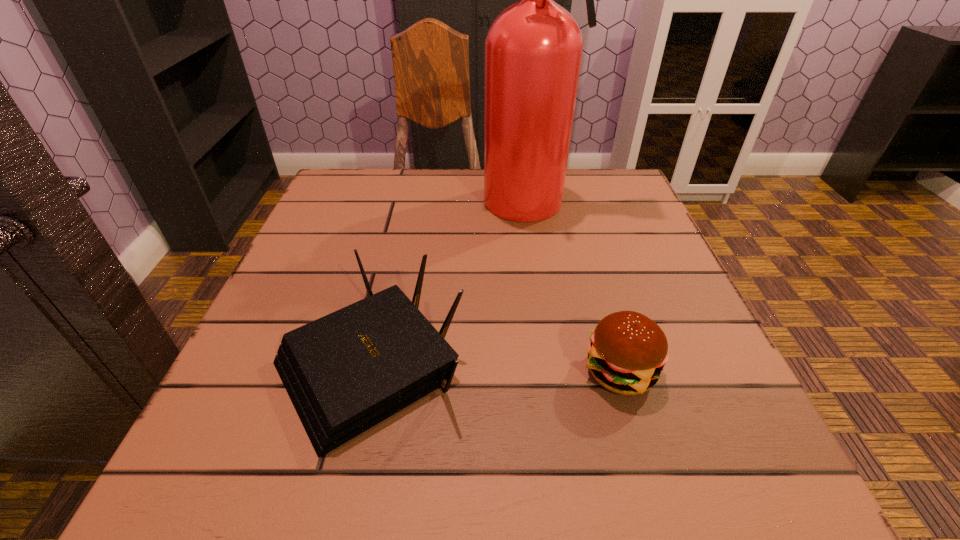
At what (x,y) coordinates should I click in order to perform the action: click on object that is at the left edge. Please return your answer as a coordinate pair (x, y). The width and height of the screenshot is (960, 540). Looking at the image, I should click on (346, 372).

Locate an element on the screen. Image resolution: width=960 pixels, height=540 pixels. fire extinguisher situated at the right edge is located at coordinates (533, 50).

This screenshot has width=960, height=540. Identify the location of hamburger positioned at the right edge. (628, 351).

The image size is (960, 540). In order to click on object present at the near left corner in this screenshot , I will do `click(346, 372)`.

The height and width of the screenshot is (540, 960). Identify the location of object that is at the far right corner. (533, 50).

The image size is (960, 540). What are the coordinates of `free space at the far edge` in the screenshot? It's located at pos(479,204).

Where is `free region at the near edge of the desktop`? This screenshot has height=540, width=960. free region at the near edge of the desktop is located at coordinates (423, 491).

In the image, there is a desktop. In order to click on free space at the left edge in this screenshot , I will do `click(324, 226)`.

This screenshot has height=540, width=960. What are the coordinates of `free space at the right edge of the desktop` in the screenshot? It's located at (650, 237).

In order to click on free space at the far left corner of the desktop in this screenshot , I will do `click(397, 179)`.